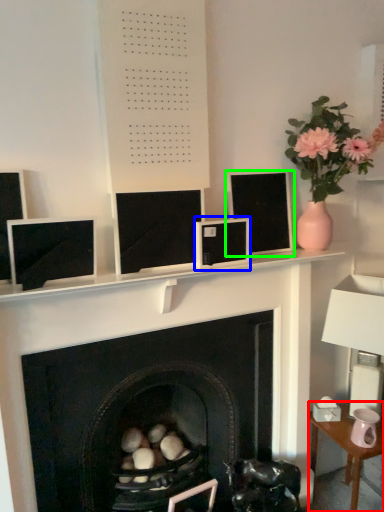
Question: Which object is the farthest from table (highlighted by a red box)? Choose among these: computer monitor (highlighted by a blue box) or computer monitor (highlighted by a green box).

Choices:
 (A) computer monitor
 (B) computer monitor

Answer: (A)